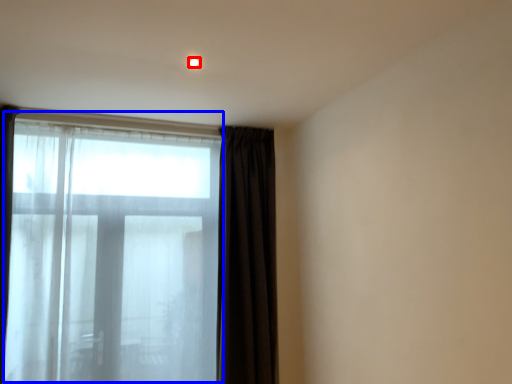
Question: Which object appears farthest to the camera in this image, light (highlighted by a red box) or bay window (highlighted by a blue box)?

Choices:
 (A) light
 (B) bay window

Answer: (B)